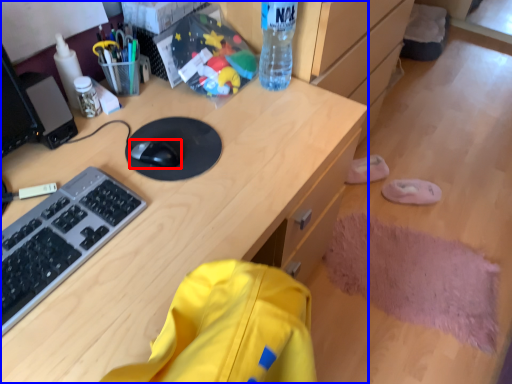
Question: Which point is closer to the camera, mouse (highlighted by a red box) or desk (highlighted by a blue box)?

Choices:
 (A) mouse
 (B) desk

Answer: (B)